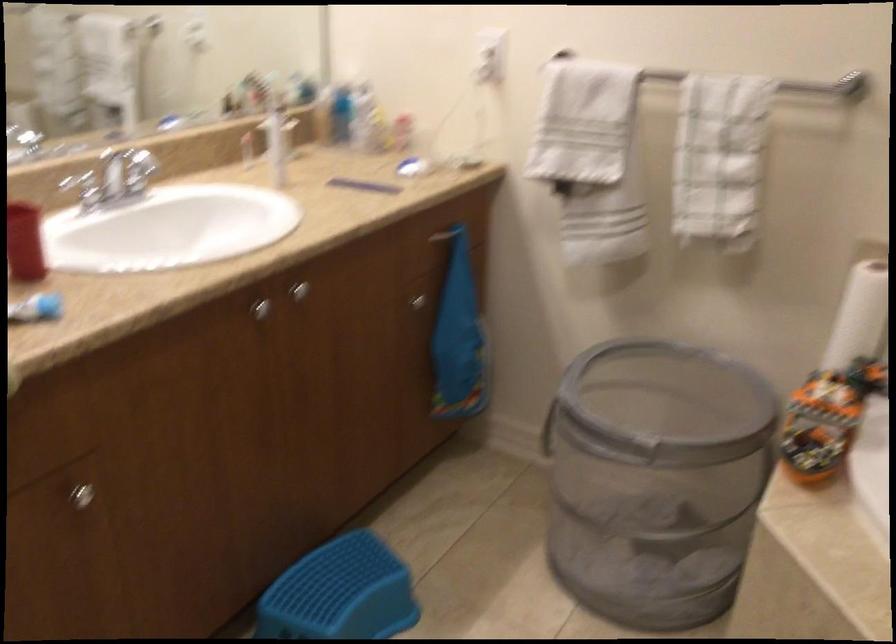
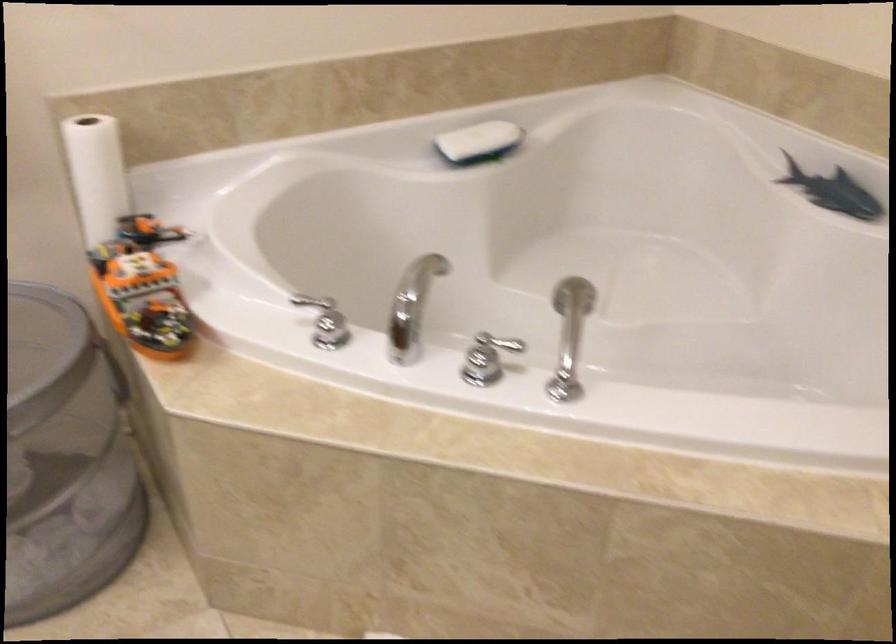
Based on the continuous images, in which direction is the camera rotating?

The camera's rotation is toward right-down.